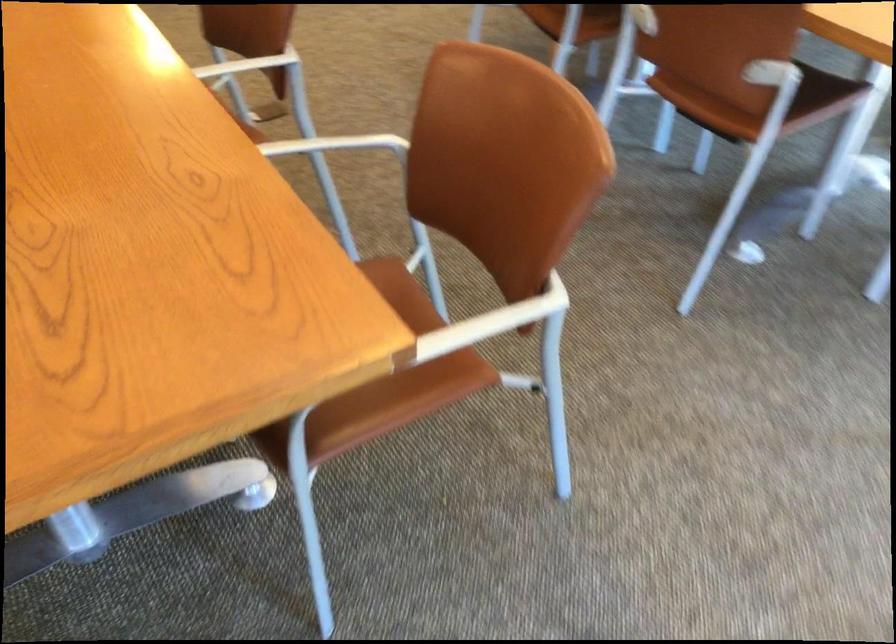
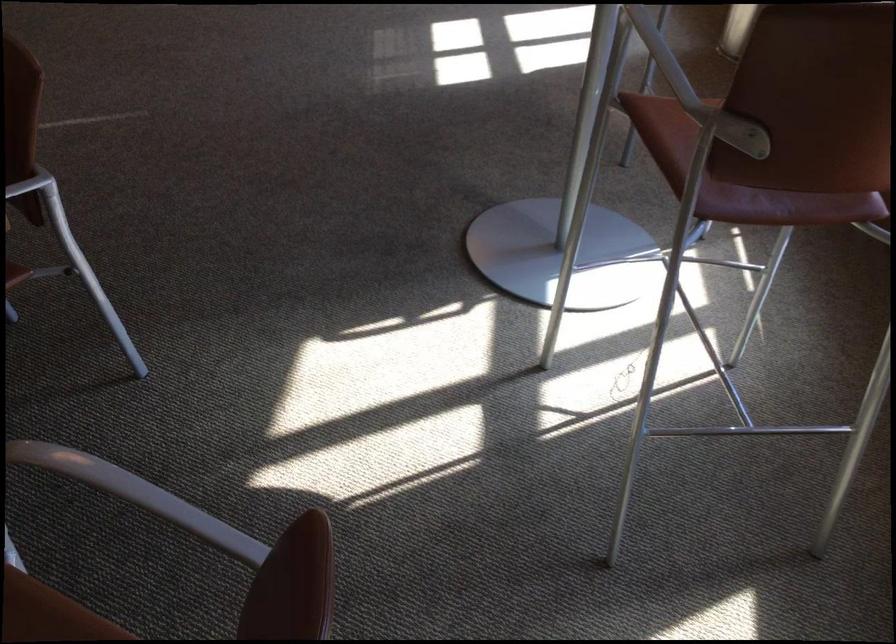
Question: Which direction would the cameraman need to move to produce the second image? Reply with the corresponding letter.

Choices:
 (A) Left
 (B) Right
 (C) Forward
 (D) Backward

Answer: (B)